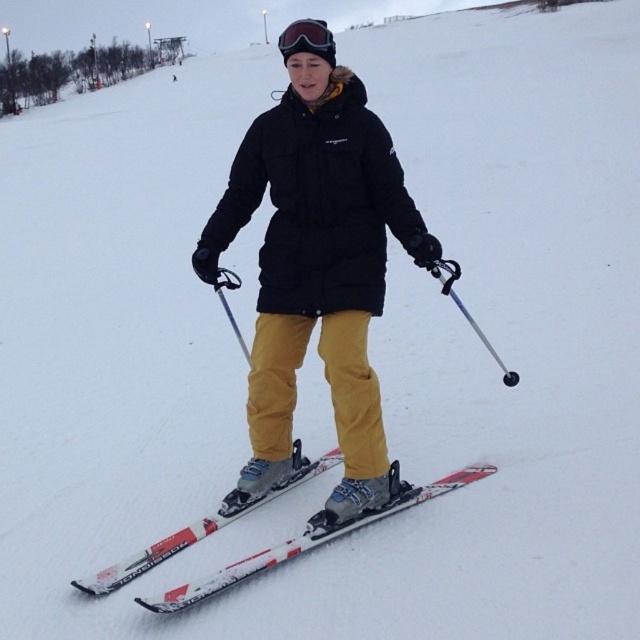
You are a photographer trying to capture a closeup shot of the skier. You notice the white matte skis at center and the glossy ski goggles at center. Which object should you focus on first if you want to ensure both are in focus without moving the camera?

The white matte skis at center is to the right of glossy ski goggles at center, so focusing on the white matte skis at center first will ensure both objects are in focus since it is farther away from the camera.

You are a photographer trying to capture the skier in the image. You need to ensure that both the matte black jacket at center and the glossy ski goggles at center are visible in your shot. Given their sizes, which object should you focus on to ensure both are in frame without zooming in or out?

The matte black jacket at center is wider than the glossy ski goggles at center, so focusing on the matte black jacket at center ensures both objects are in frame without needing to adjust the zoom.